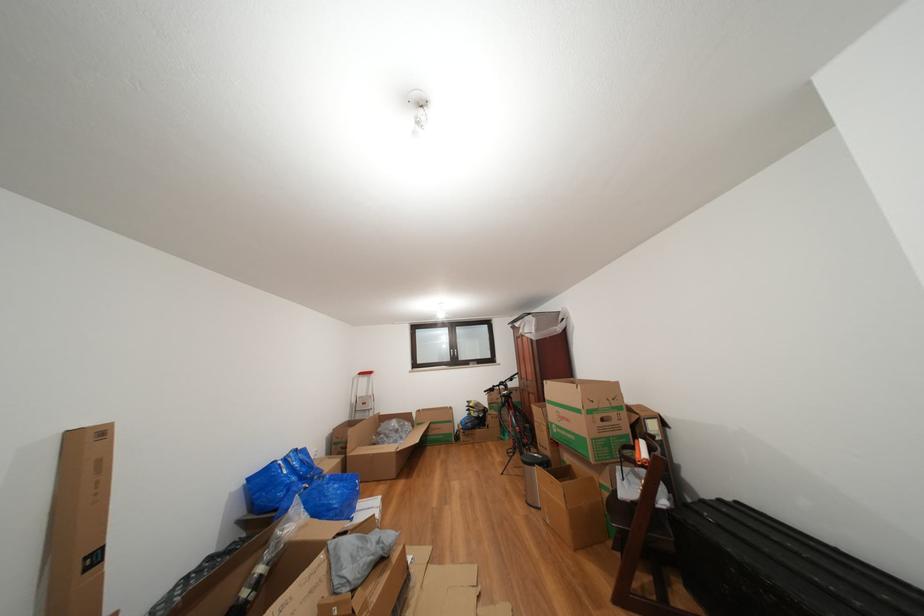
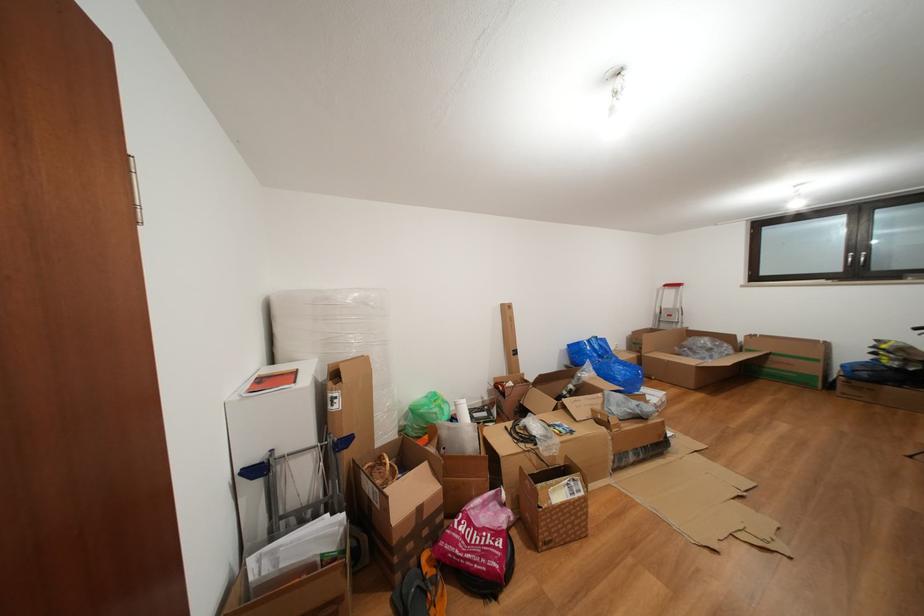
The point at (369, 379) is marked in the first image. Where is the corresponding point in the second image?

(674, 291)